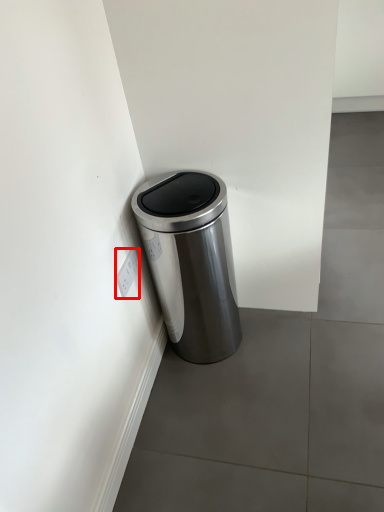
Question: From the image, what is the correct spatial relationship of electric outlet (annotated by the red box) in relation to waste container?

Choices:
 (A) left
 (B) right

Answer: (A)